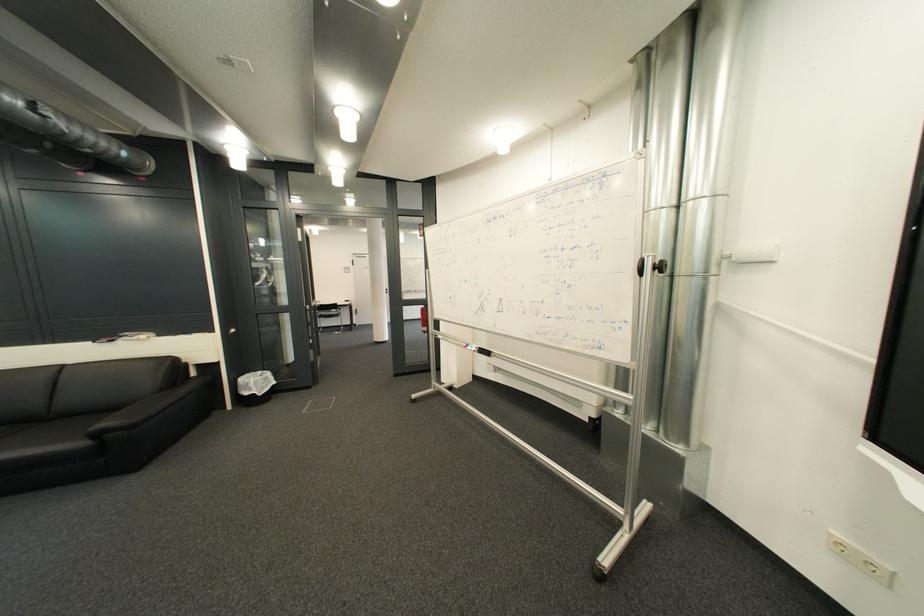
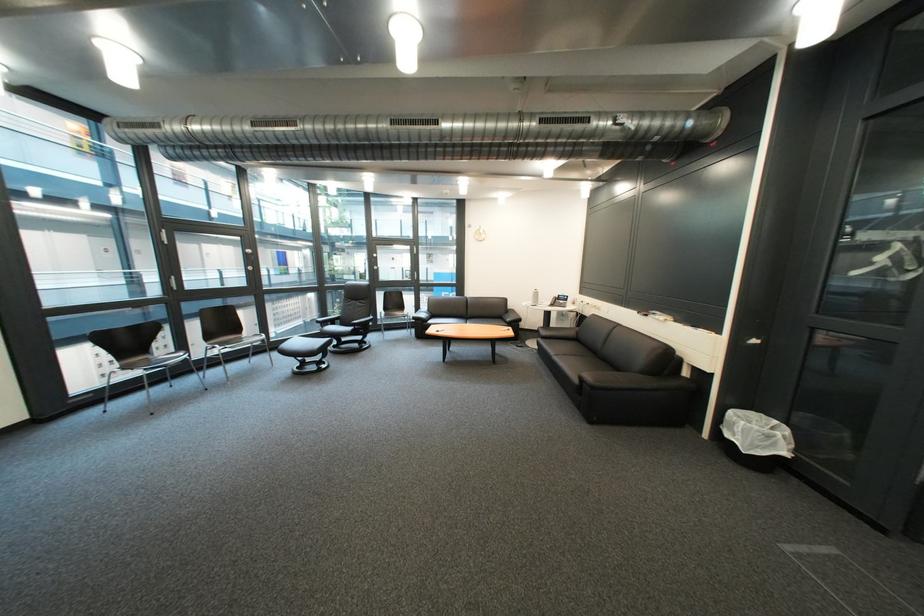
In the second image, find the point that corresponds to pixel 265 387 in the first image.

(751, 431)